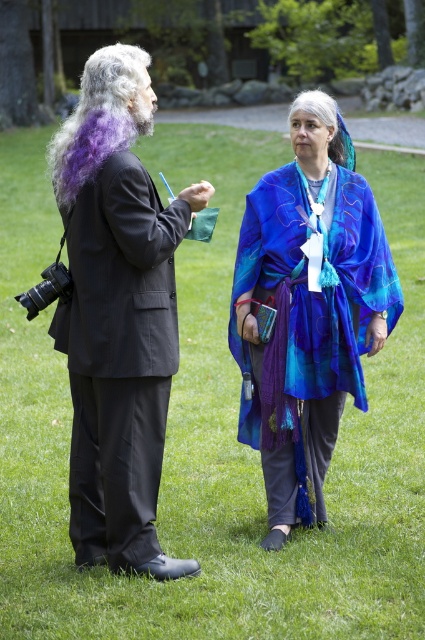
Question: Does blue silk scarf at center appear under purple silky hair at left?

Choices:
 (A) no
 (B) yes

Answer: (B)

Question: Can you confirm if purple silky hair at left is thinner than gray/blue fabric at center?

Choices:
 (A) yes
 (B) no

Answer: (B)

Question: Which of the following is the closest to the observer?

Choices:
 (A) (319, 97)
 (B) (79, 468)
 (C) (312, 93)
 (D) (133, 138)

Answer: (D)

Question: Which of the following is the farthest from the observer?

Choices:
 (A) purple silky hair at left
 (B) matte black suit at left
 (C) gray/blue fabric at center

Answer: (C)

Question: Is blue silk scarf at center to the left of gray/blue fabric at center from the viewer's perspective?

Choices:
 (A) no
 (B) yes

Answer: (B)

Question: Which of these objects is positioned closest to the purple silky hair at left?

Choices:
 (A) blue silk scarf at center
 (B) matte black suit at left

Answer: (A)